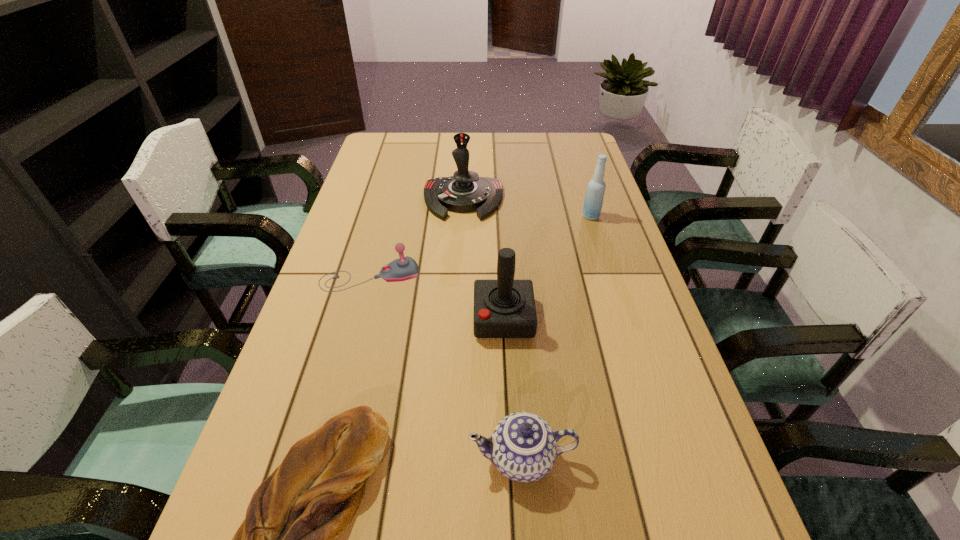
Locate an element on the screen. free location located 0.380m on the base of the nearest joystick is located at coordinates (321, 318).

Where is `blank space located from the spout of the chinaware`? The image size is (960, 540). blank space located from the spout of the chinaware is located at coordinates (263, 458).

The image size is (960, 540). What are the coordinates of `vacant space located from the spout of the chinaware` in the screenshot? It's located at (258, 458).

Find the location of a particular element. This screenshot has width=960, height=540. free space located from the spout of the chinaware is located at coordinates (x=432, y=458).

I want to click on free space located on the front of the second shortest object, so click(358, 321).

Locate an element on the screen. The image size is (960, 540). object that is at the left edge is located at coordinates (404, 268).

Where is `object present at the right edge`? This screenshot has height=540, width=960. object present at the right edge is located at coordinates (593, 201).

This screenshot has height=540, width=960. I want to click on vacant space at the far edge of the desktop, so click(422, 141).

Find the location of a particular element. free spot at the left edge of the desktop is located at coordinates (378, 162).

Identify the location of vacant space at the right edge of the desktop. (603, 323).